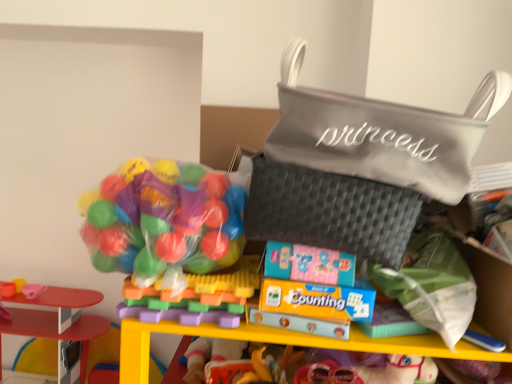
Where is `gray quilted pouch at upper right, which ranks as the 1th pouch in top-to-bottom order`? This screenshot has width=512, height=384. gray quilted pouch at upper right, which ranks as the 1th pouch in top-to-bottom order is located at coordinates (381, 133).

Find the location of a particular element. smooth plastic cup at left, which is the 2th toy in bottom-to-top order is located at coordinates (21, 288).

What do you see at coordinates (196, 297) in the screenshot? The width and height of the screenshot is (512, 384). I see `translucent plastic balls at left, which is the 1th toy from right to left` at bounding box center [196, 297].

The image size is (512, 384). In order to click on matte black pouch at center, positioned as the 2th pouch in top-to-bottom order in this screenshot , I will do `click(330, 211)`.

The height and width of the screenshot is (384, 512). Find the location of `green fabric pouch at lower right, the 3th pouch from the top`. green fabric pouch at lower right, the 3th pouch from the top is located at coordinates (431, 285).

This screenshot has width=512, height=384. Describe the element at coordinates (58, 326) in the screenshot. I see `smooth plastic toy house at lower left, positioned as the second toy in back-to-front order` at that location.

You are a GUI agent. You are given a task and a screenshot of the screen. Output one action in this format:
    pyautogui.click(x=<x>, y=<y>)
    Task: Click on the gray quilted pouch at upper right, which ranks as the 1th pouch in top-to-bottom order
    The height and width of the screenshot is (384, 512).
    Given the screenshot: What is the action you would take?
    (x=381, y=133)

Are green fabric pouch at lower right, the 3th pouch from the top, and matte black pouch at center, acting as the second pouch starting from the bottom, far apart?

No, there isn't a large distance between green fabric pouch at lower right, the 3th pouch from the top, and matte black pouch at center, acting as the second pouch starting from the bottom.

Is matte black pouch at center, acting as the second pouch starting from the bottom, inside green fabric pouch at lower right, the 3th pouch from the top?

No.

Does green fabric pouch at lower right, the 3th pouch from the top, have a larger size compared to matte black pouch at center, acting as the second pouch starting from the bottom?

No.

Which is behind, point (464, 280) or point (335, 178)?

The point (464, 280) is farther from the camera.

Is point (462, 330) in front of point (180, 301)?

That is True.

Would you say green fabric pouch at lower right, which is the 1th pouch in bottom-to-top order, is outside translucent plastic balls at left, the third toy from the left?

That's correct, green fabric pouch at lower right, which is the 1th pouch in bottom-to-top order, is outside of translucent plastic balls at left, the third toy from the left.

Which of these two, green fabric pouch at lower right, the 3th pouch from the top, or translucent plastic balls at left, which is the 1th toy from right to left, is thinner?

green fabric pouch at lower right, the 3th pouch from the top.

In terms of size, does smooth plastic cup at left, which is the 3th toy in right-to-left order, appear bigger or smaller than gray quilted pouch at upper right, which ranks as the 1th pouch in top-to-bottom order?

smooth plastic cup at left, which is the 3th toy in right-to-left order, is smaller than gray quilted pouch at upper right, which ranks as the 1th pouch in top-to-bottom order.

How much distance is there between smooth plastic cup at left, the second toy in the top-to-bottom sequence, and gray quilted pouch at upper right, placed as the third pouch when sorted from bottom to top?

smooth plastic cup at left, the second toy in the top-to-bottom sequence, is 5.10 feet from gray quilted pouch at upper right, placed as the third pouch when sorted from bottom to top.

In terms of height, does smooth plastic cup at left, the 1th toy positioned from the left, look taller or shorter compared to gray quilted pouch at upper right, which ranks as the 1th pouch in top-to-bottom order?

Clearly, smooth plastic cup at left, the 1th toy positioned from the left, is shorter compared to gray quilted pouch at upper right, which ranks as the 1th pouch in top-to-bottom order.

Which is in front, smooth plastic cup at left, placed as the 3th toy when sorted from front to back, or gray quilted pouch at upper right, placed as the third pouch when sorted from bottom to top?

gray quilted pouch at upper right, placed as the third pouch when sorted from bottom to top, is closer to the camera.

Can smooth plastic cup at left, which is the 2th toy in bottom-to-top order, be found inside translucent plastic balls at left, the 3th toy positioned from the bottom?

Actually, smooth plastic cup at left, which is the 2th toy in bottom-to-top order, is outside translucent plastic balls at left, the 3th toy positioned from the bottom.

Which of these two, translucent plastic balls at left, the 1th toy viewed from the top, or smooth plastic cup at left, which is the 3th toy in right-to-left order, stands taller?

With more height is translucent plastic balls at left, the 1th toy viewed from the top.

Could you tell me if translucent plastic balls at left, which is the 1th toy from right to left, is turned towards smooth plastic cup at left, which is the 3th toy in right-to-left order?

No, translucent plastic balls at left, which is the 1th toy from right to left, is not oriented towards smooth plastic cup at left, which is the 3th toy in right-to-left order.

Consider the image. From a real-world perspective, who is located higher, smooth plastic toy house at lower left, arranged as the 3th toy when viewed from the top, or gray quilted pouch at upper right, placed as the third pouch when sorted from bottom to top?

In real-world perspective, gray quilted pouch at upper right, placed as the third pouch when sorted from bottom to top, is above.

Considering the positions of objects smooth plastic toy house at lower left, which is the second toy in left-to-right order, and gray quilted pouch at upper right, placed as the third pouch when sorted from bottom to top, in the image provided, who is behind, smooth plastic toy house at lower left, which is the second toy in left-to-right order, or gray quilted pouch at upper right, placed as the third pouch when sorted from bottom to top,?

Positioned behind is smooth plastic toy house at lower left, which is the second toy in left-to-right order.

Considering the sizes of smooth plastic toy house at lower left, marked as the second toy in a front-to-back arrangement, and gray quilted pouch at upper right, which ranks as the 1th pouch in top-to-bottom order, in the image, is smooth plastic toy house at lower left, marked as the second toy in a front-to-back arrangement, taller or shorter than gray quilted pouch at upper right, which ranks as the 1th pouch in top-to-bottom order,?

smooth plastic toy house at lower left, marked as the second toy in a front-to-back arrangement, is taller than gray quilted pouch at upper right, which ranks as the 1th pouch in top-to-bottom order.

Who is bigger, smooth plastic cup at left, which is the first toy in back-to-front order, or green fabric pouch at lower right, the 3th pouch from the top?

green fabric pouch at lower right, the 3th pouch from the top, is bigger.

Does point (42, 288) come farther from viewer compared to point (401, 272)?

That is True.

Is the surface of smooth plastic cup at left, the second toy in the top-to-bottom sequence, in direct contact with green fabric pouch at lower right, which is the 1th pouch in bottom-to-top order?

No, smooth plastic cup at left, the second toy in the top-to-bottom sequence, is not touching green fabric pouch at lower right, which is the 1th pouch in bottom-to-top order.

From the picture: Considering the sizes of objects smooth plastic cup at left, which is the first toy in back-to-front order, and green fabric pouch at lower right, which is the 1th pouch in bottom-to-top order, in the image provided, who is shorter, smooth plastic cup at left, which is the first toy in back-to-front order, or green fabric pouch at lower right, which is the 1th pouch in bottom-to-top order,?

Standing shorter between the two is smooth plastic cup at left, which is the first toy in back-to-front order.

Is point (59, 292) less distant than point (1, 285)?

Yes, point (59, 292) is in front of point (1, 285).

Could smooth plastic cup at left, the 1th toy positioned from the left, be considered to be inside smooth plastic toy house at lower left, positioned as the second toy in back-to-front order?

No, smooth plastic cup at left, the 1th toy positioned from the left, is not surrounded by smooth plastic toy house at lower left, positioned as the second toy in back-to-front order.

From a real-world perspective, is smooth plastic toy house at lower left, marked as the second toy in a front-to-back arrangement, over smooth plastic cup at left, the second toy in the top-to-bottom sequence?

No, from a real-world perspective, smooth plastic toy house at lower left, marked as the second toy in a front-to-back arrangement, is not over smooth plastic cup at left, the second toy in the top-to-bottom sequence

Where is `pouch that is the 2nd one when counting rightward from the matte black pouch at center, acting as the second pouch starting from the bottom`? The image size is (512, 384). pouch that is the 2nd one when counting rightward from the matte black pouch at center, acting as the second pouch starting from the bottom is located at coordinates (431, 285).

The height and width of the screenshot is (384, 512). I want to click on the 1st toy located beneath the green fabric pouch at lower right, the 3th pouch from the top (from a real-world perspective), so click(x=196, y=297).

Based on the photo, looking at the image, which one is located closer to translucent plastic balls at left, the 1th toy when ordered from front to back, smooth plastic toy house at lower left, positioned as the second toy in back-to-front order, or matte black pouch at center, positioned as the 2th pouch in top-to-bottom order?

matte black pouch at center, positioned as the 2th pouch in top-to-bottom order, is closer to translucent plastic balls at left, the 1th toy when ordered from front to back.

Based on their spatial positions, is matte black pouch at center, positioned as the 2th pouch in top-to-bottom order, or green fabric pouch at lower right, which is the 1th pouch in bottom-to-top order, closer to smooth plastic toy house at lower left, which is the second toy in left-to-right order?

Based on the image, matte black pouch at center, positioned as the 2th pouch in top-to-bottom order, appears to be nearer to smooth plastic toy house at lower left, which is the second toy in left-to-right order.

Considering their positions, is gray quilted pouch at upper right, which ranks as the 1th pouch in top-to-bottom order, positioned closer to matte black pouch at center, acting as the second pouch starting from the bottom, than translucent plastic balls at left, the third toy from the left?

Based on the image, gray quilted pouch at upper right, which ranks as the 1th pouch in top-to-bottom order, appears to be nearer to matte black pouch at center, acting as the second pouch starting from the bottom.

When comparing their distances from gray quilted pouch at upper right, placed as the third pouch when sorted from bottom to top, does green fabric pouch at lower right, which is the 1th pouch in bottom-to-top order, or smooth plastic cup at left, which is the first toy in back-to-front order, seem further?

smooth plastic cup at left, which is the first toy in back-to-front order, is positioned further to the anchor gray quilted pouch at upper right, placed as the third pouch when sorted from bottom to top.

When comparing their distances from smooth plastic toy house at lower left, the 2th toy positioned from the right, does translucent plastic balls at left or translucent plastic balls at left, which is the 1th toy from right to left, seem closer?

translucent plastic balls at left, which is the 1th toy from right to left, lies closer to smooth plastic toy house at lower left, the 2th toy positioned from the right, than the other object.

Based on their spatial positions, is smooth plastic cup at left, which is the 2th toy in bottom-to-top order, or gray quilted pouch at upper right, which ranks as the 1th pouch in top-to-bottom order, further from matte black pouch at center, positioned as the 2th pouch in top-to-bottom order?

smooth plastic cup at left, which is the 2th toy in bottom-to-top order, lies further to matte black pouch at center, positioned as the 2th pouch in top-to-bottom order, than the other object.

Based on their spatial positions, is translucent plastic balls at left or smooth plastic cup at left, the 1th toy positioned from the left, further from green fabric pouch at lower right, the 3th pouch from the top?

smooth plastic cup at left, the 1th toy positioned from the left, is positioned further to the anchor green fabric pouch at lower right, the 3th pouch from the top.

When comparing their distances from translucent plastic balls at left, does smooth plastic cup at left, which is the 2th toy in bottom-to-top order, or translucent plastic balls at left, which is the 1th toy from right to left, seem closer?

translucent plastic balls at left, which is the 1th toy from right to left, is positioned closer to the anchor translucent plastic balls at left.

I want to click on toy between smooth plastic toy house at lower left, which appears as the 1th toy when ordered from the bottom, and gray quilted pouch at upper right, which ranks as the 1th pouch in top-to-bottom order, in the horizontal direction, so (x=196, y=297).

You are a GUI agent. You are given a task and a screenshot of the screen. Output one action in this format:
    pyautogui.click(x=<x>, y=<y>)
    Task: Click on the candy situated between smooth plastic toy house at lower left, the 2th toy positioned from the right, and matte black pouch at center, acting as the second pouch starting from the bottom, from left to right
    
    Given the screenshot: What is the action you would take?
    point(164,221)

The image size is (512, 384). In order to click on pouch between smooth plastic toy house at lower left, arranged as the 3th toy when viewed from the top, and gray quilted pouch at upper right, which ranks as the 1th pouch in top-to-bottom order in this screenshot , I will do `click(330, 211)`.

Find the location of `toy between translucent plastic balls at left, the 1th toy when ordered from front to back, and smooth plastic cup at left, which is the 3th toy in right-to-left order, in the front-back direction`. toy between translucent plastic balls at left, the 1th toy when ordered from front to back, and smooth plastic cup at left, which is the 3th toy in right-to-left order, in the front-back direction is located at coordinates (58, 326).